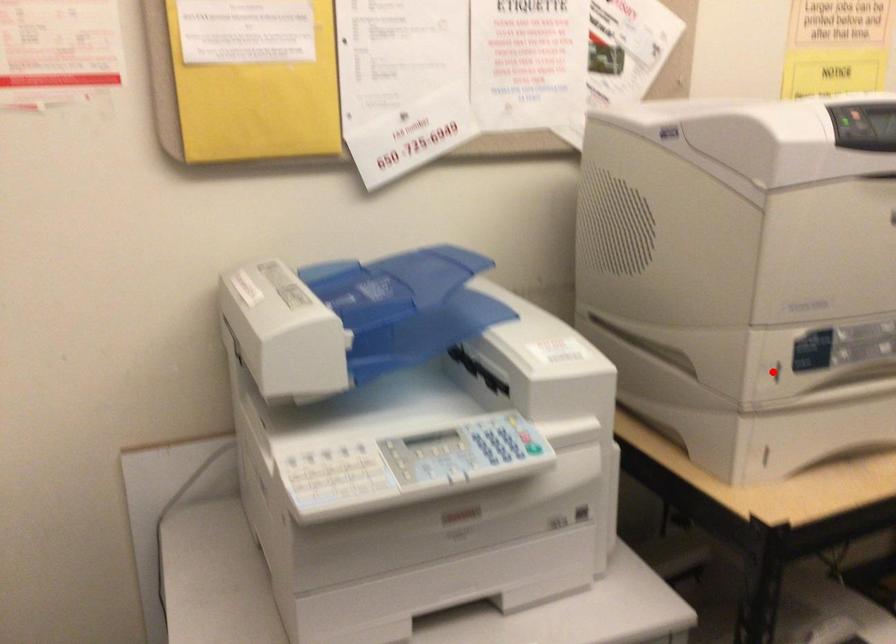
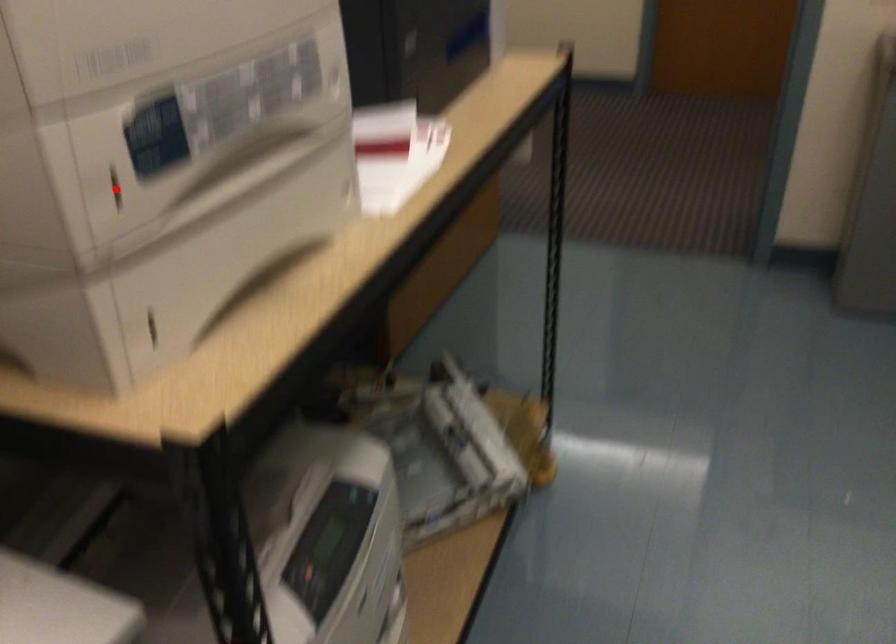
I am providing you with two images of the same scene from different viewpoints. A red point is marked on the first image and another point is marked on the second image. Is the marked point in image1 the same physical position as the marked point in image2?

Yes